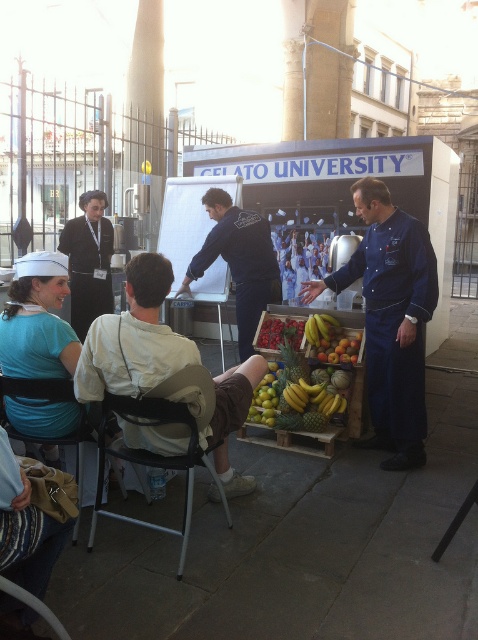
Question: Can you confirm if glossy wooden crate of fruits at center is wider than matte blue uniform at lower left?

Choices:
 (A) yes
 (B) no

Answer: (A)

Question: Which of the following is the closest to the observer?

Choices:
 (A) (387, 372)
 (B) (56, 404)
 (C) (234, 252)

Answer: (B)

Question: Does blue cotton jacket at right appear on the right side of black plastic chair at lower center?

Choices:
 (A) no
 (B) yes

Answer: (B)

Question: Is black fabric uniform at left smaller than black plastic chair at lower left?

Choices:
 (A) yes
 (B) no

Answer: (B)

Question: Which object is positioned closest to the yellow bananas at center?

Choices:
 (A) black fabric uniform at left
 (B) dark blue fabric at center
 (C) black plastic chair at lower left
 (D) matte blue uniform at lower left

Answer: (B)

Question: Which point is farther from the camera taking this photo?

Choices:
 (A) coord(235,221)
 (B) coord(191,468)
 (C) coord(109,365)

Answer: (A)